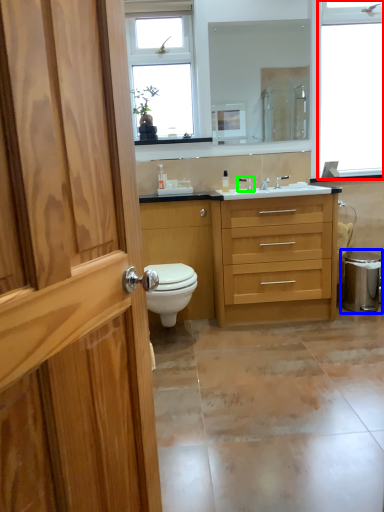
Question: Based on their relative distances, which object is farther from window (highlighted by a red box)? Choose from water heater (highlighted by a blue box) and tap (highlighted by a green box).

Choices:
 (A) water heater
 (B) tap

Answer: (A)